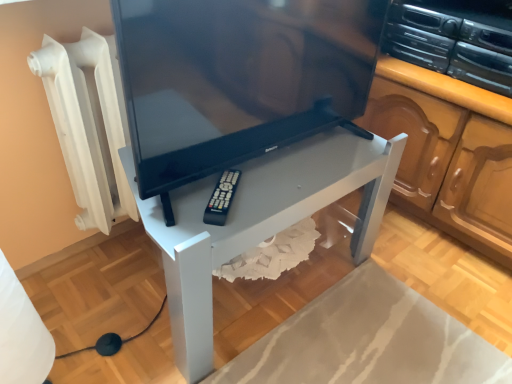
Question: Does black plastic remote at lower center have a smaller size compared to white glossy table at center?

Choices:
 (A) yes
 (B) no

Answer: (A)

Question: Can you confirm if black plastic remote at lower center is positioned to the right of white glossy table at center?

Choices:
 (A) no
 (B) yes

Answer: (A)

Question: From a real-world perspective, is black plastic remote at lower center positioned over white glossy table at center based on gravity?

Choices:
 (A) no
 (B) yes

Answer: (B)

Question: Is black plastic remote at lower center not within white glossy table at center?

Choices:
 (A) no
 (B) yes

Answer: (A)

Question: Is black plastic remote at lower center facing towards white glossy table at center?

Choices:
 (A) yes
 (B) no

Answer: (A)

Question: In the image, is black plastic remote at lower center on the left side or the right side of white glossy table at center?

Choices:
 (A) right
 (B) left

Answer: (B)

Question: From their relative heights in the image, would you say black plastic remote at lower center is taller or shorter than white glossy table at center?

Choices:
 (A) tall
 (B) short

Answer: (B)

Question: Choose the correct answer: Is black plastic remote at lower center inside white glossy table at center or outside it?

Choices:
 (A) outside
 (B) inside

Answer: (B)

Question: Considering the positions of black plastic remote at lower center and white glossy table at center in the image, is black plastic remote at lower center bigger or smaller than white glossy table at center?

Choices:
 (A) small
 (B) big

Answer: (A)

Question: Considering their positions, is black plastic stereo at upper right located in front of or behind white glossy table at center?

Choices:
 (A) front
 (B) behind

Answer: (B)

Question: Is point (420, 31) closer or farther from the camera than point (200, 337)?

Choices:
 (A) closer
 (B) farther

Answer: (B)

Question: From a real-world perspective, is black plastic stereo at upper right positioned above or below white glossy table at center?

Choices:
 (A) above
 (B) below

Answer: (A)

Question: From the image's perspective, is black plastic stereo at upper right positioned above or below white glossy table at center?

Choices:
 (A) above
 (B) below

Answer: (A)

Question: Is point (208, 279) positioned closer to the camera than point (243, 8)?

Choices:
 (A) closer
 (B) farther

Answer: (B)

Question: Considering the positions of white glossy table at center and black glossy tv at center in the image, is white glossy table at center bigger or smaller than black glossy tv at center?

Choices:
 (A) small
 (B) big

Answer: (B)